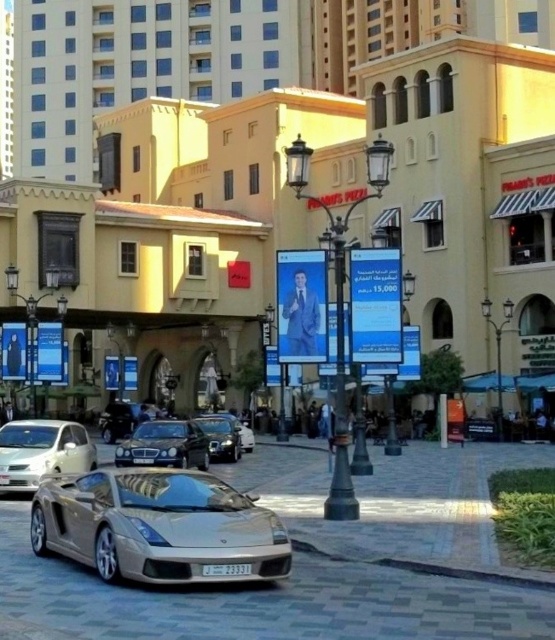
Is shiny silver sports car at center below silver metallic sports car at center?

Correct, shiny silver sports car at center is located below silver metallic sports car at center.

Who is more forward, (107, 412) or (249, 429)?

Point (249, 429) is in front.

Find the location of a particular element. This screenshot has width=555, height=640. shiny silver sports car at center is located at coordinates (122, 419).

Who is taller, gold metallic sports car at center or white glossy sedan at lower left?

Standing taller between the two is gold metallic sports car at center.

Between gold metallic sports car at center and white glossy sedan at lower left, which one is positioned lower?

gold metallic sports car at center is below.

Find the location of a particular element. The image size is (555, 640). gold metallic sports car at center is located at coordinates (158, 525).

Does matte yellow building at center appear on the right side of shiny silver car at center?

Indeed, matte yellow building at center is positioned on the right side of shiny silver car at center.

Can you confirm if matte yellow building at center is positioned to the left of shiny silver car at center?

No, matte yellow building at center is not to the left of shiny silver car at center.

Measure the distance between matte yellow building at center and camera.

matte yellow building at center and camera are 36.04 meters apart.

The width and height of the screenshot is (555, 640). In order to click on matte yellow building at center in this screenshot , I will do `click(278, 170)`.